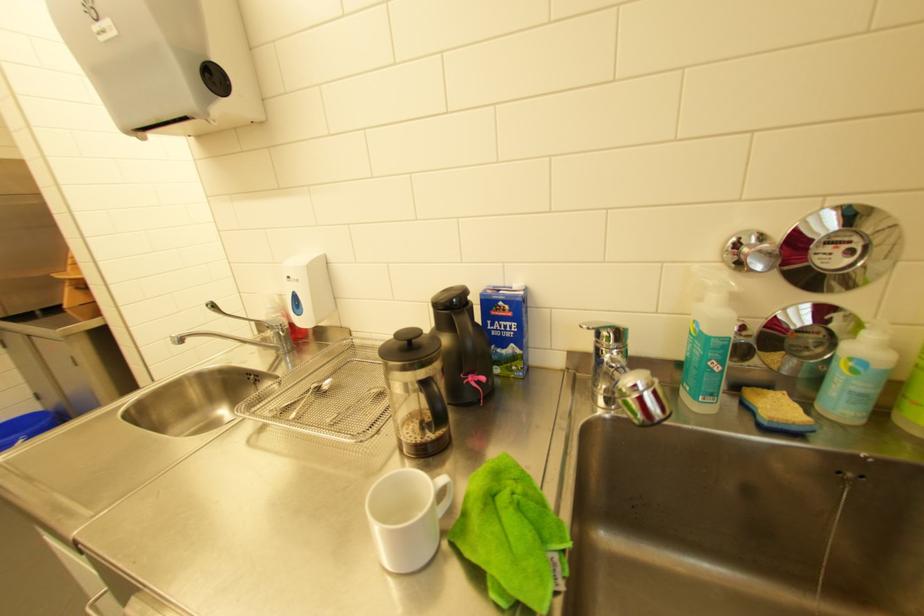
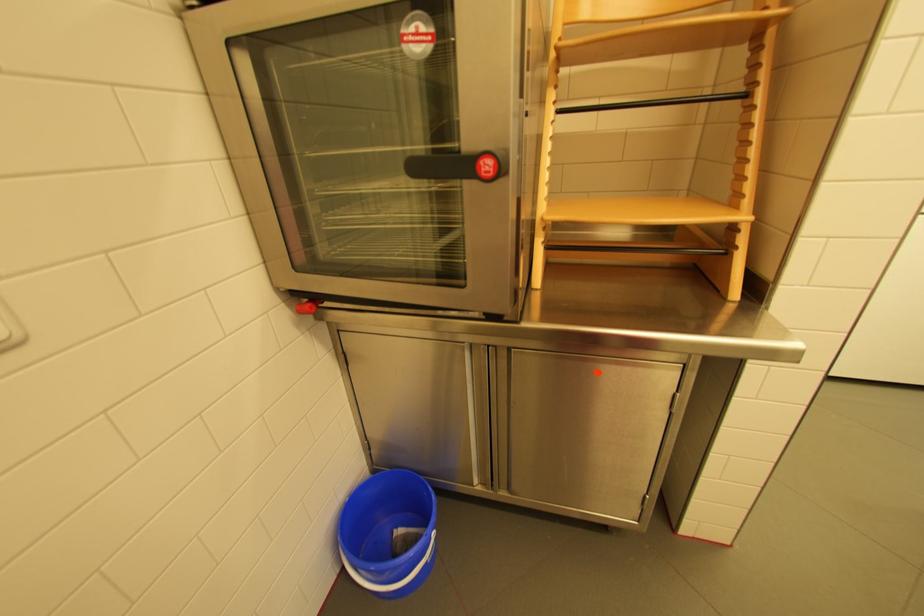
In a continuous first-person perspective shot, in which direction is the camera moving?

The movement direction of the cameraman is left, forward.